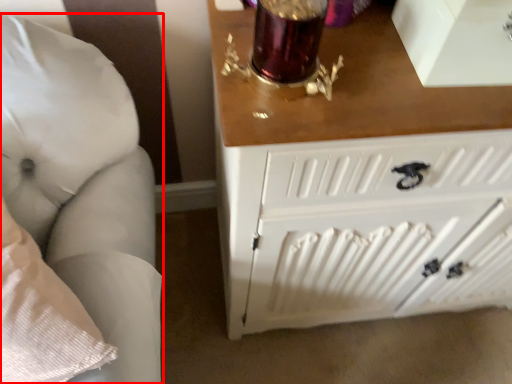
Question: From the image's perspective, where is furniture (annotated by the red box) located relative to radiator?

Choices:
 (A) below
 (B) above

Answer: (B)